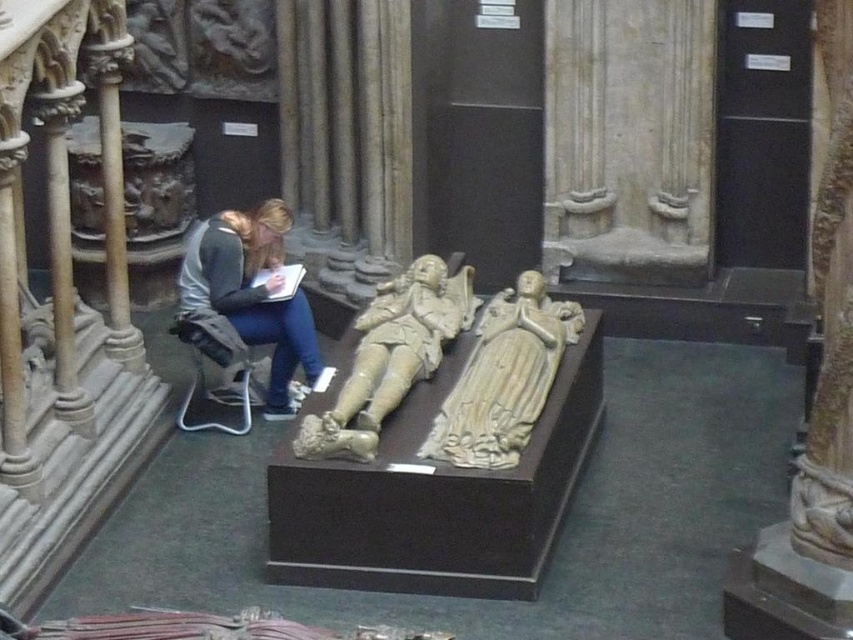
Consider the image. You are standing in the museum and want to examine the stone carving at center up close. The museum has a rule that visitors must stay at least 1.5 meters away from all exhibits for preservation. Are you currently violating the rule?

The stone carving at center and viewer are 11.20 meters apart from each other, so you are not violating the museum rule since you are more than 1.5 meters away.

Based on the photo, you are an art conservator tasked with moving the stone carving at center and the stone statue at center to a new exhibition space. The transport crate you have can only accommodate items up to the size of the larger object. Which object should you use to determine the crate size?

The stone statue at center is larger than the stone carving at center, so the crate should be sized to accommodate the stone statue at center.

You are an art conservator examining the two stone effigies displayed on the pedestal. You notice two specific points marked on the pedestal. Which of the two points, point (405, 356) or point (283, 227), is positioned closer to your viewpoint as you stand in front of the display?

Point (405, 356) is closer to the viewer than point (283, 227).